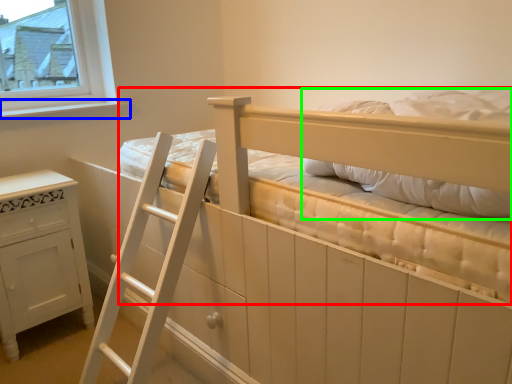
Question: Which is nearer to the bed (highlighted by a red box)? window sill (highlighted by a blue box) or pillow (highlighted by a green box).

Choices:
 (A) window sill
 (B) pillow

Answer: (B)